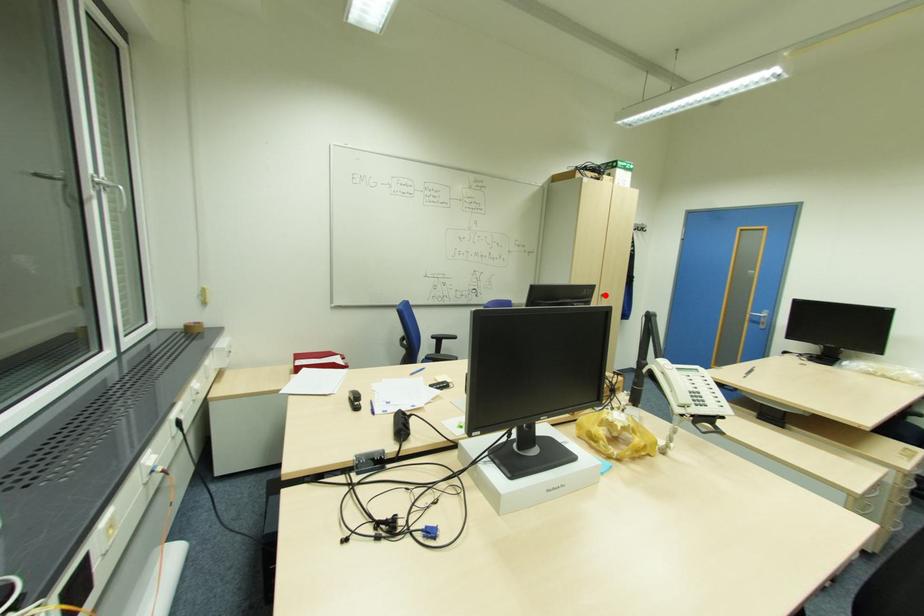
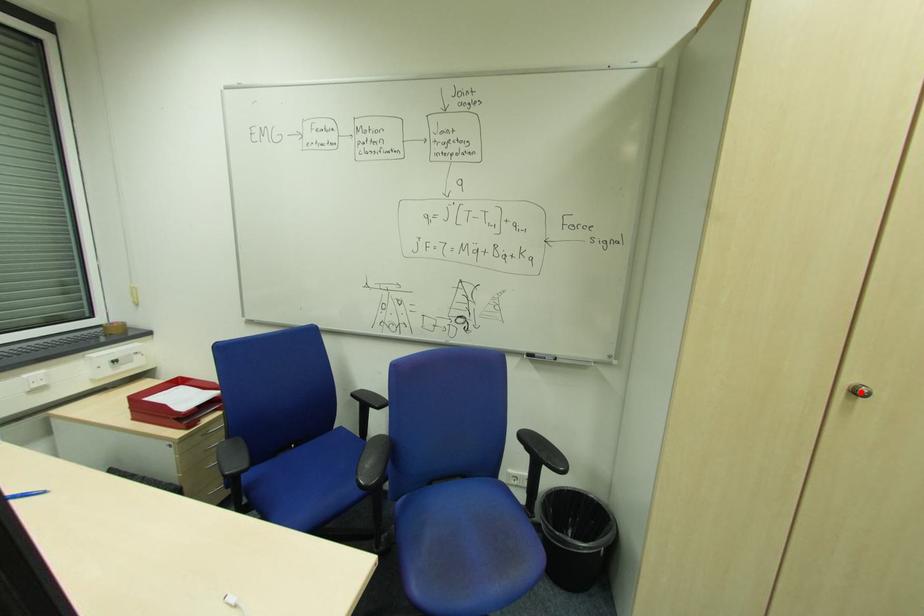
I am providing you with two images of the same scene from different viewpoints. A red point is marked on the first image and another point is marked on the second image. Do the highlighted points in image1 and image2 indicate the same real-world spot?

Yes